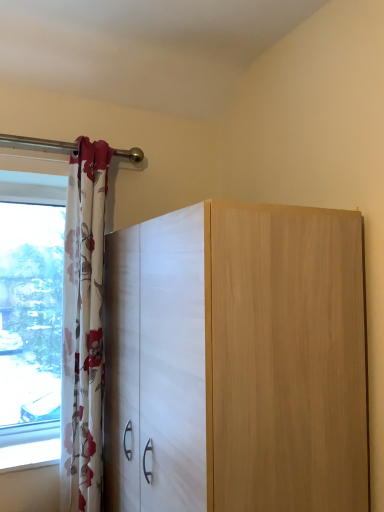
What is the approximate width of floral fabric curtain at left?

floral fabric curtain at left is 7.05 inches wide.

What do you see at coordinates (83, 328) in the screenshot? Image resolution: width=384 pixels, height=512 pixels. I see `floral fabric curtain at left` at bounding box center [83, 328].

The image size is (384, 512). What are the coordinates of `floral fabric curtain at left` in the screenshot? It's located at (83, 328).

Locate an element on the screen. The width and height of the screenshot is (384, 512). matte white cabinet at center is located at coordinates (236, 361).

In order to face matte white cabinet at center, should I rotate leftwards or rightwards?

Turn right by 2.224 degrees to look at matte white cabinet at center.

Describe the element at coordinates (236, 361) in the screenshot. I see `matte white cabinet at center` at that location.

Find the location of a particular element. floral fabric curtain at left is located at coordinates (83, 328).

Considering the relative positions of matte white cabinet at center and floral fabric curtain at left in the image provided, is matte white cabinet at center to the right of floral fabric curtain at left from the viewer's perspective?

Yes, matte white cabinet at center is to the right of floral fabric curtain at left.

Does matte white cabinet at center lie in front of floral fabric curtain at left?

Yes, the depth of matte white cabinet at center is less than that of floral fabric curtain at left.

Is point (362, 277) closer to camera compared to point (64, 264)?

Yes, it is.

From the image's perspective, who appears lower, matte white cabinet at center or floral fabric curtain at left?

From the image's view, matte white cabinet at center is below.

From a real-world perspective, which object stands above the other?

From a 3D spatial view, floral fabric curtain at left is above.

Which of these two, matte white cabinet at center or floral fabric curtain at left, is wider?

Wider between the two is matte white cabinet at center.

Which of these two, matte white cabinet at center or floral fabric curtain at left, stands taller?

floral fabric curtain at left.

Considering the relative sizes of matte white cabinet at center and floral fabric curtain at left in the image provided, is matte white cabinet at center bigger than floral fabric curtain at left?

Yes, matte white cabinet at center is bigger than floral fabric curtain at left.

Is matte white cabinet at center outside of floral fabric curtain at left?

matte white cabinet at center is positioned outside floral fabric curtain at left.

Would you say matte white cabinet at center is a long distance from floral fabric curtain at left?

No, matte white cabinet at center is not far away from floral fabric curtain at left.

Does matte white cabinet at center turn towards floral fabric curtain at left?

Yes.

In the scene shown: What's the angular difference between matte white cabinet at center and floral fabric curtain at left's facing directions?

90 degrees separate the facing orientations of matte white cabinet at center and floral fabric curtain at left.

Identify the location of cupboard below the floral fabric curtain at left (from a real-world perspective). The width and height of the screenshot is (384, 512). (236, 361).

Is floral fabric curtain at left at the right side of matte white cabinet at center?

No.

Which is behind, floral fabric curtain at left or matte white cabinet at center?

floral fabric curtain at left is more distant.

Considering the points (81, 355) and (180, 452), which point is behind, point (81, 355) or point (180, 452)?

The point (81, 355) is farther.

From the image's perspective, would you say floral fabric curtain at left is shown under matte white cabinet at center?

No, from the image's perspective, floral fabric curtain at left is not beneath matte white cabinet at center.

From a real-world perspective, which object rests below the other?

From a 3D spatial view, matte white cabinet at center is below.

From the picture: Which of these two, floral fabric curtain at left or matte white cabinet at center, is wider?

matte white cabinet at center.

Does floral fabric curtain at left have a greater height compared to matte white cabinet at center?

Yes, floral fabric curtain at left is taller than matte white cabinet at center.

Does floral fabric curtain at left have a larger size compared to matte white cabinet at center?

Actually, floral fabric curtain at left might be smaller than matte white cabinet at center.

Is floral fabric curtain at left completely or partially outside of matte white cabinet at center?

That's correct, floral fabric curtain at left is outside of matte white cabinet at center.

Does floral fabric curtain at left touch matte white cabinet at center?

No, floral fabric curtain at left is not beside matte white cabinet at center.

Is floral fabric curtain at left looking in the opposite direction of matte white cabinet at center?

No, matte white cabinet at center is not at the back of floral fabric curtain at left.

How many degrees apart are the facing directions of floral fabric curtain at left and matte white cabinet at center?

They differ by 90 degrees in their facing directions.

Find the location of a particular element. The height and width of the screenshot is (512, 384). cupboard located in front of the floral fabric curtain at left is located at coordinates (236, 361).

At what (x,y) coordinates should I click in order to perform the action: click on curtain behind the matte white cabinet at center. Please return your answer as a coordinate pair (x, y). Looking at the image, I should click on (83, 328).

Find the location of a particular element. This screenshot has height=512, width=384. curtain lying above the matte white cabinet at center (from the image's perspective) is located at coordinates (83, 328).